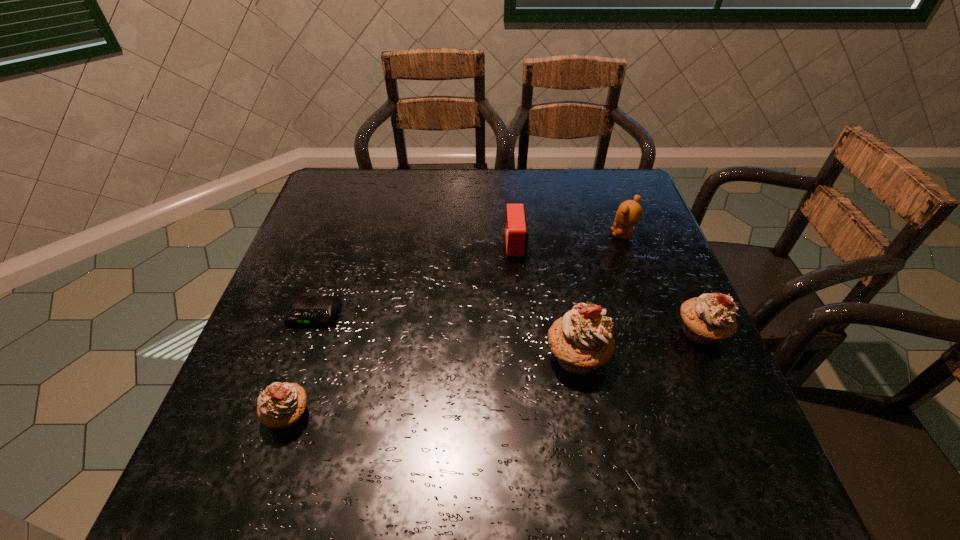
Please point a space for a new cupcake to maintain equal intervals. Please provide its 2D coordinates. Your answer should be formatted as a tuple, i.e. [(x, y)], where the tuple contains the x and y coordinates of a point satisfying the conditions above.

[(441, 384)]